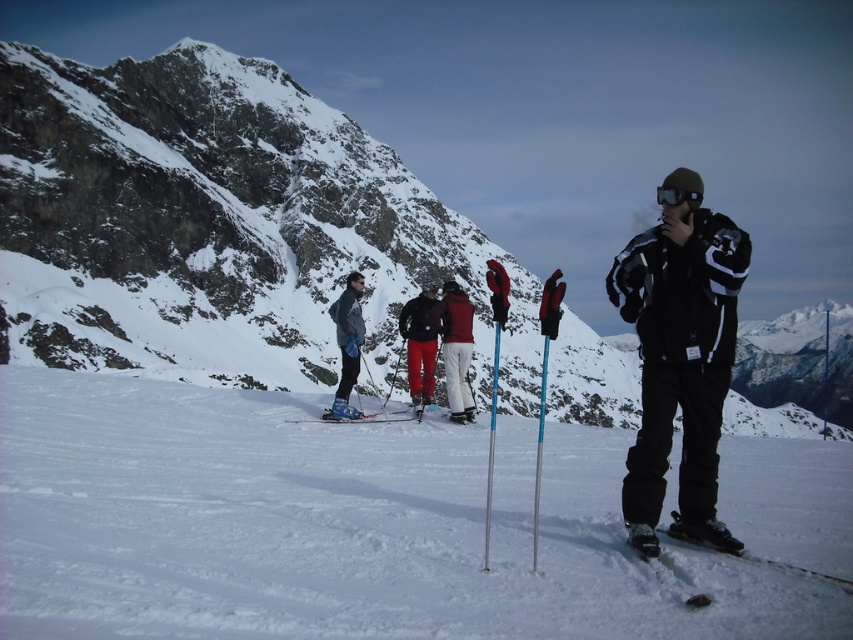
Question: Can you confirm if matte red pants at center is positioned to the right of black matte goggles at center?

Choices:
 (A) yes
 (B) no

Answer: (B)

Question: Does matte red pants at center have a smaller size compared to brushed metal ski pole at center?

Choices:
 (A) yes
 (B) no

Answer: (A)

Question: Which point appears closest to the camera in this image?

Choices:
 (A) (614, 275)
 (B) (70, 540)
 (C) (346, 419)
 (D) (175, 122)

Answer: (B)

Question: Which is nearer to the red fabric jacket at center?

Choices:
 (A) black matte goggles at center
 (B) brushed metal ski pole at center
 (C) snowy rock at center

Answer: (B)

Question: Which point is closer to the camera?

Choices:
 (A) matte red pants at center
 (B) white powder snow at center
 (C) matte black ski at center

Answer: (B)

Question: Can you confirm if black matte goggles at center is wider than matte black ski at center?

Choices:
 (A) no
 (B) yes

Answer: (B)